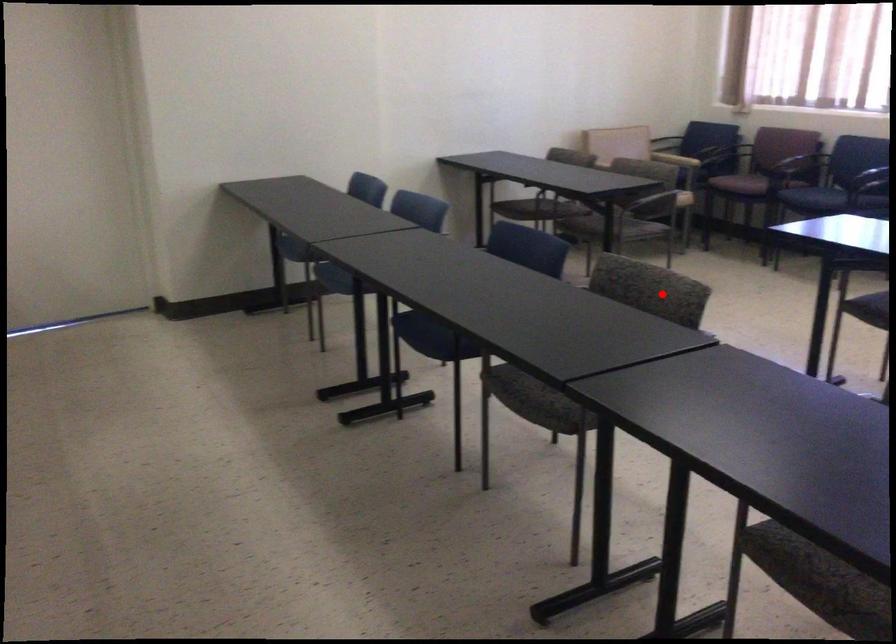
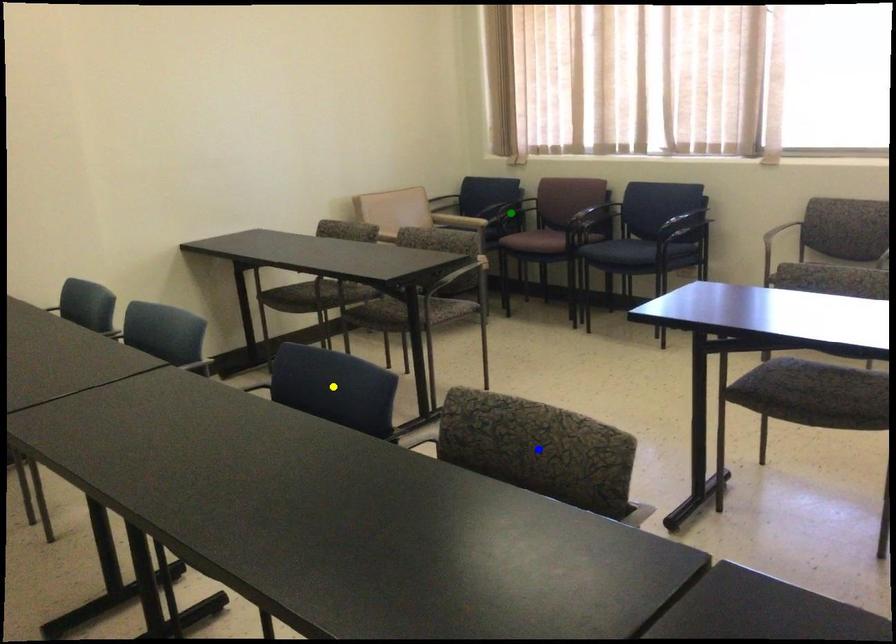
Question: I am providing you with two images of the same scene from different viewpoints. A red point is marked on the first image. You are given multiple points on the second image. Which spot in image 2 lines up with the point in image 1?

Choices:
 (A) yellow point
 (B) blue point
 (C) green point

Answer: (B)